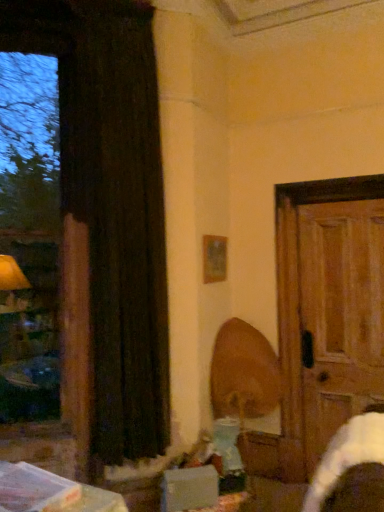
Question: Does wooden picture frame at upper center have a greater height compared to white cardboard box at lower center?

Choices:
 (A) yes
 (B) no

Answer: (A)

Question: From a real-world perspective, is wooden picture frame at upper center positioned under white cardboard box at lower center based on gravity?

Choices:
 (A) no
 (B) yes

Answer: (A)

Question: Is wooden picture frame at upper center at the left side of white cardboard box at lower center?

Choices:
 (A) no
 (B) yes

Answer: (A)

Question: Is wooden picture frame at upper center wider than white cardboard box at lower center?

Choices:
 (A) yes
 (B) no

Answer: (B)

Question: Is wooden picture frame at upper center shorter than white cardboard box at lower center?

Choices:
 (A) no
 (B) yes

Answer: (A)

Question: Does wooden picture frame at upper center contain white cardboard box at lower center?

Choices:
 (A) yes
 (B) no

Answer: (B)

Question: Is wooden swivel chair at center with white cardboard box at lower center?

Choices:
 (A) no
 (B) yes

Answer: (A)

Question: Is wooden swivel chair at center looking in the opposite direction of white cardboard box at lower center?

Choices:
 (A) yes
 (B) no

Answer: (B)

Question: Is wooden swivel chair at center at the right side of white cardboard box at lower center?

Choices:
 (A) no
 (B) yes

Answer: (B)

Question: Would you consider wooden swivel chair at center to be distant from white cardboard box at lower center?

Choices:
 (A) no
 (B) yes

Answer: (A)

Question: From a real-world perspective, does wooden swivel chair at center stand above white cardboard box at lower center?

Choices:
 (A) no
 (B) yes

Answer: (B)

Question: Is the depth of wooden swivel chair at center less than that of white cardboard box at lower center?

Choices:
 (A) yes
 (B) no

Answer: (B)

Question: Is wooden swivel chair at center bigger than black velvet curtain at left?

Choices:
 (A) no
 (B) yes

Answer: (A)